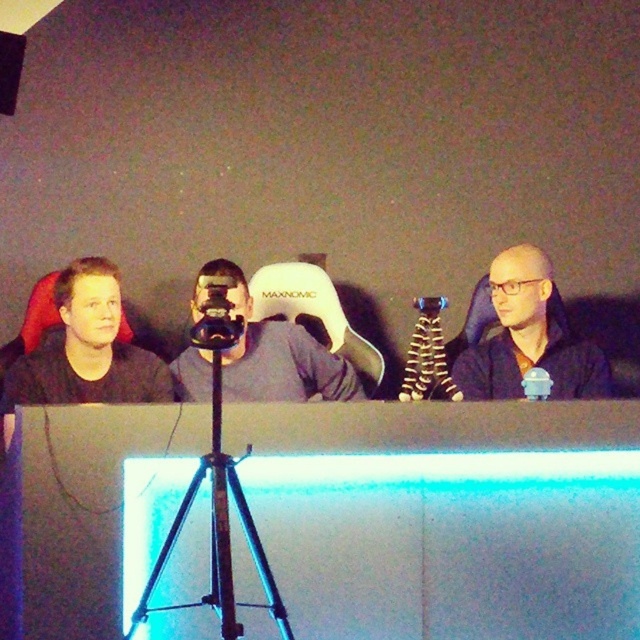
Question: Is black matte jacket at center positioned at the back of matte gray chair at center?

Choices:
 (A) yes
 (B) no

Answer: (B)

Question: Does black matte jacket at center appear on the right side of metallic tripod at center?

Choices:
 (A) no
 (B) yes

Answer: (B)

Question: Is matte gray chair at center above black plastic camera at center?

Choices:
 (A) no
 (B) yes

Answer: (A)

Question: Which object is the farthest from the black plastic camera at center?

Choices:
 (A) matte gray chair at center
 (B) black matte jacket at center

Answer: (B)

Question: Which point appears closest to the camera in this image?

Choices:
 (A) (227, 276)
 (B) (172, 532)
 (C) (305, 388)
 (D) (492, 397)

Answer: (B)

Question: Estimate the real-world distances between objects in this image. Which object is farther from the black plastic camera at center?

Choices:
 (A) metallic tripod at center
 (B) black matte jacket at center

Answer: (B)